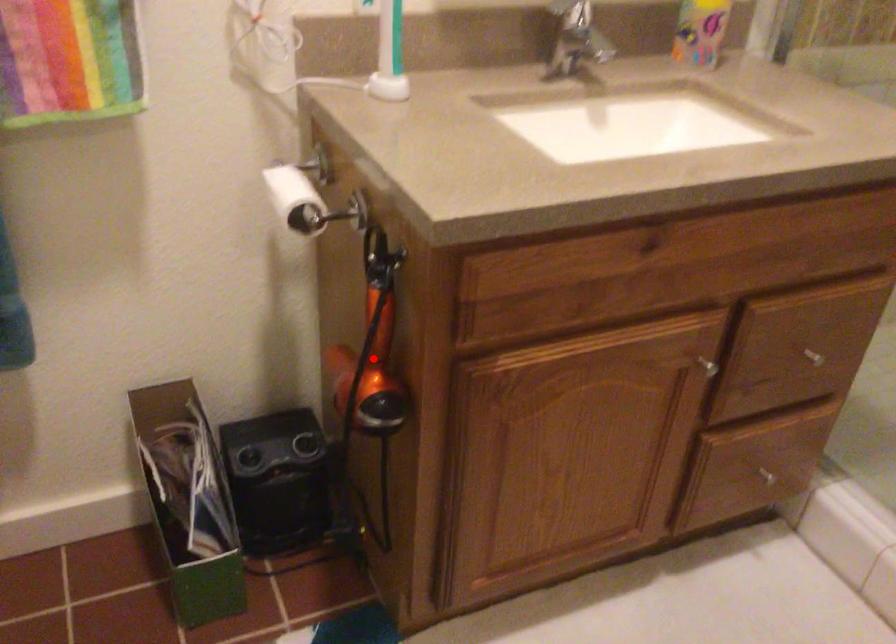
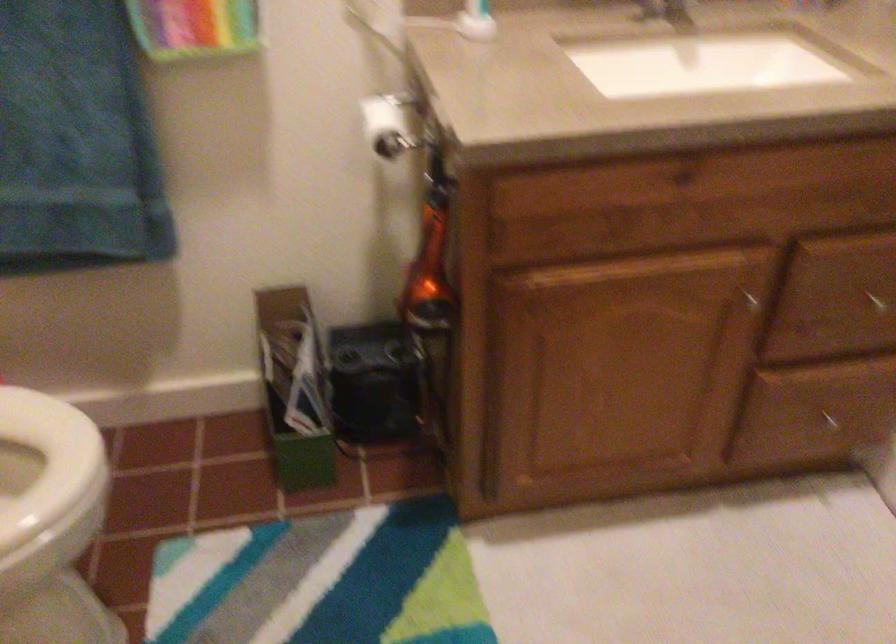
Question: A red point is marked in image1. In image2, is the corresponding 3D point closer to the camera or farther? Reply with the corresponding letter.

Choices:
 (A) The corresponding 3D point is closer.
 (B) The corresponding 3D point is farther.

Answer: (B)